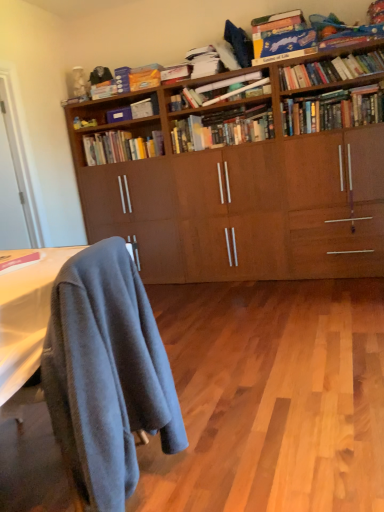
Question: From a real-world perspective, is matte pink book at lower left, which ranks as the first book in bottom-to-top order, located beneath hardcover books at center, arranged as the 3th book when ordered from the bottom?

Choices:
 (A) no
 (B) yes

Answer: (B)

Question: Is matte pink book at lower left, the eleventh book from the top, far away from hardcover books at center, arranged as the 3th book when ordered from the bottom?

Choices:
 (A) no
 (B) yes

Answer: (B)

Question: Does matte pink book at lower left, the eleventh book from the top, have a larger size compared to hardcover books at center, the ninth book viewed from the top?

Choices:
 (A) no
 (B) yes

Answer: (A)

Question: Is matte pink book at lower left, which ranks as the first book in bottom-to-top order, further to the viewer compared to hardcover books at center, arranged as the 3th book when ordered from the bottom?

Choices:
 (A) no
 (B) yes

Answer: (A)

Question: Is matte pink book at lower left, which ranks as the first book in bottom-to-top order, at the right side of hardcover books at center, arranged as the 3th book when ordered from the bottom?

Choices:
 (A) no
 (B) yes

Answer: (A)

Question: Is blue cardboard game at upper right, the tenth book ordered from the bottom, in front of or behind hardcover books at center, arranged as the 10th book when viewed from the top, in the image?

Choices:
 (A) front
 (B) behind

Answer: (A)

Question: From a real-world perspective, is blue cardboard game at upper right, the tenth book ordered from the bottom, positioned above or below hardcover books at center, which is the 2th book in bottom-to-top order?

Choices:
 (A) above
 (B) below

Answer: (A)

Question: Looking at the image, does blue cardboard game at upper right, placed as the second book when sorted from top to bottom, seem bigger or smaller compared to hardcover books at center, which is the 2th book in bottom-to-top order?

Choices:
 (A) small
 (B) big

Answer: (A)

Question: Is blue cardboard game at upper right, placed as the second book when sorted from top to bottom, wider or thinner than hardcover books at center, which is the 2th book in bottom-to-top order?

Choices:
 (A) wide
 (B) thin

Answer: (A)

Question: Looking at the image, does hardcover books at center, arranged as the 3th book when ordered from the bottom, seem bigger or smaller compared to matte pink book at lower left, which ranks as the first book in bottom-to-top order?

Choices:
 (A) small
 (B) big

Answer: (B)

Question: Is hardcover books at center, arranged as the 3th book when ordered from the bottom, spatially inside matte pink book at lower left, the eleventh book from the top, or outside of it?

Choices:
 (A) inside
 (B) outside

Answer: (B)

Question: In the image, is hardcover books at center, the ninth book viewed from the top, positioned in front of or behind matte pink book at lower left, which ranks as the first book in bottom-to-top order?

Choices:
 (A) front
 (B) behind

Answer: (B)

Question: From their relative heights in the image, would you say hardcover books at center, the ninth book viewed from the top, is taller or shorter than matte pink book at lower left, the eleventh book from the top?

Choices:
 (A) tall
 (B) short

Answer: (A)

Question: From a real-world perspective, is hardcover books at center, arranged as the 10th book when viewed from the top, positioned above or below hardcover books at center, arranged as the 3th book when ordered from the bottom?

Choices:
 (A) above
 (B) below

Answer: (B)

Question: In terms of width, does hardcover books at center, which is the 2th book in bottom-to-top order, look wider or thinner when compared to hardcover books at center, the ninth book viewed from the top?

Choices:
 (A) wide
 (B) thin

Answer: (B)